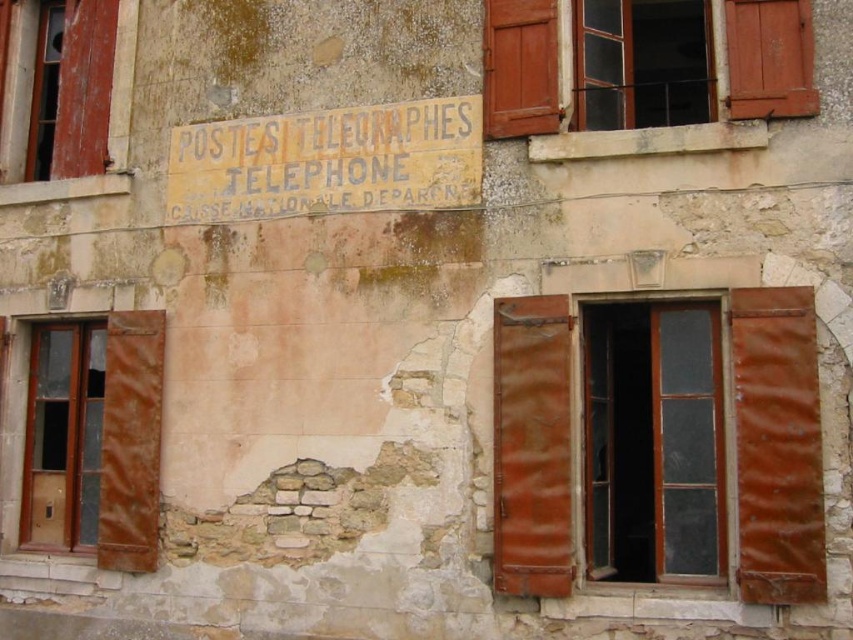
Is yellow faded paper sign at upper center further to the viewer compared to brown wooden window at left?

No, yellow faded paper sign at upper center is in front of brown wooden window at left.

Can you confirm if yellow faded paper sign at upper center is wider than brown wooden window at left?

Yes, yellow faded paper sign at upper center is wider than brown wooden window at left.

Is point (378, 192) closer to camera compared to point (131, 403)?

Yes, it is in front of point (131, 403).

Locate an element on the screen. yellow faded paper sign at upper center is located at coordinates (328, 161).

Who is higher up, rusty metal shutter at center or wooden shuttered window at left?

wooden shuttered window at left is higher up.

Which of these two, rusty metal shutter at center or wooden shuttered window at left, stands shorter?

wooden shuttered window at left

Describe the element at coordinates (531, 445) in the screenshot. I see `rusty metal shutter at center` at that location.

Image resolution: width=853 pixels, height=640 pixels. Find the location of `rusty metal shutter at center`. rusty metal shutter at center is located at coordinates (531, 445).

Is point (519, 20) closer to camera compared to point (157, 424)?

Yes, point (519, 20) is in front of point (157, 424).

Is rustic wooden window at upper center taller than brown wooden window at left?

No, rustic wooden window at upper center is not taller than brown wooden window at left.

Is point (759, 116) positioned behind point (108, 371)?

That is False.

You are a GUI agent. You are given a task and a screenshot of the screen. Output one action in this format:
    pyautogui.click(x=<x>, y=<y>)
    Task: Click on the rustic wooden window at upper center
    Image resolution: width=853 pixels, height=640 pixels.
    Given the screenshot: What is the action you would take?
    pyautogui.click(x=769, y=58)